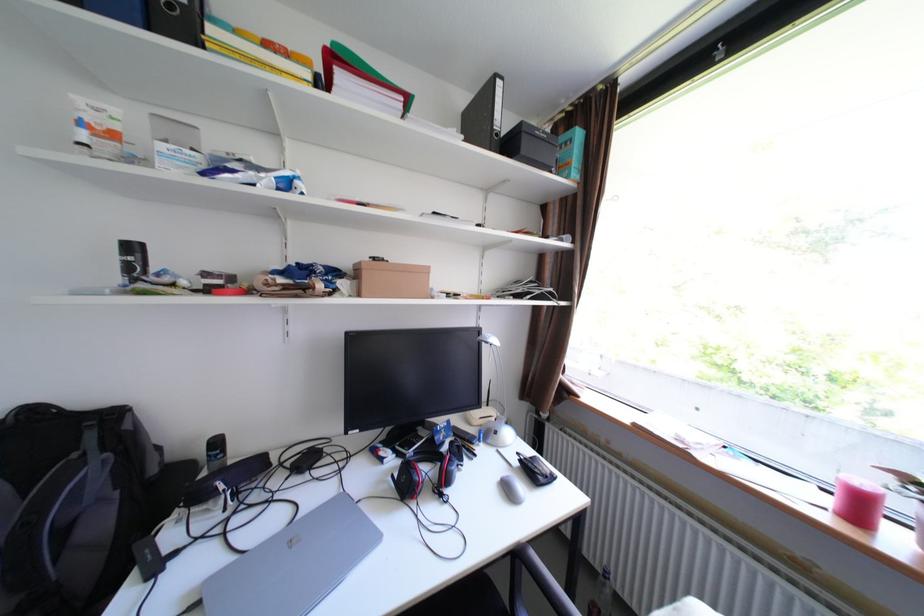
The height and width of the screenshot is (616, 924). What do you see at coordinates (424, 476) in the screenshot? I see `the red and black headphones` at bounding box center [424, 476].